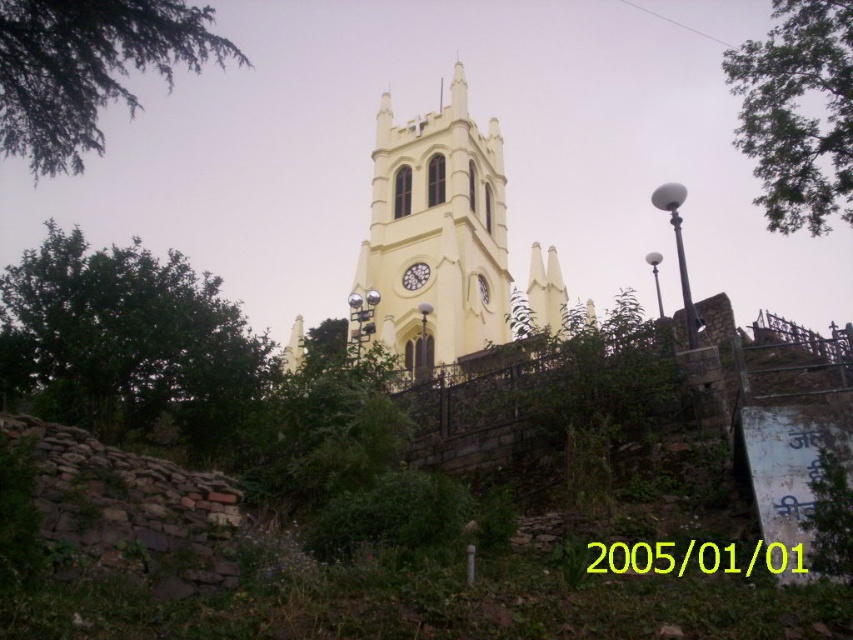
From the picture: Can you confirm if green leafy tree at left is smaller than green leafy tree at upper right?

Yes.

In the scene shown: Does green leafy tree at left have a greater height compared to green leafy tree at upper right?

Incorrect, green leafy tree at left's height is not larger of green leafy tree at upper right's.

Locate an element on the screen. The width and height of the screenshot is (853, 640). green leafy tree at left is located at coordinates (128, 342).

Can you confirm if yellow matte clock tower at center is wider than green leafy branch at upper left?

In fact, yellow matte clock tower at center might be narrower than green leafy branch at upper left.

Is yellow matte clock tower at center shorter than green leafy branch at upper left?

Yes, yellow matte clock tower at center is shorter than green leafy branch at upper left.

The height and width of the screenshot is (640, 853). I want to click on yellow matte clock tower at center, so click(x=436, y=234).

Does point (508, 284) lie in front of point (801, 93)?

No, it is behind (801, 93).

Is yellow matte clock tower at center wider than green leafy tree at upper right?

No, yellow matte clock tower at center is not wider than green leafy tree at upper right.

Does point (421, 346) lie in front of point (815, 29)?

That is False.

Find the location of a particular element. yellow matte clock tower at center is located at coordinates (436, 234).